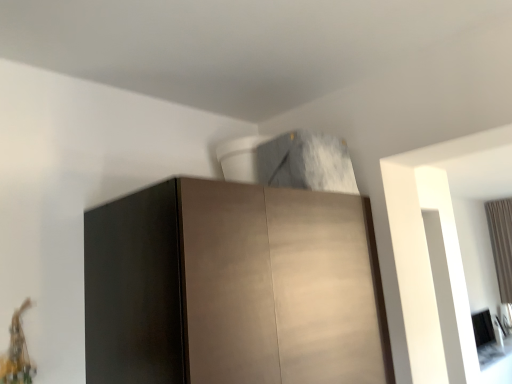
Question: Should I look upward or downward to see matte brown cabinet at center?

Choices:
 (A) down
 (B) up

Answer: (A)